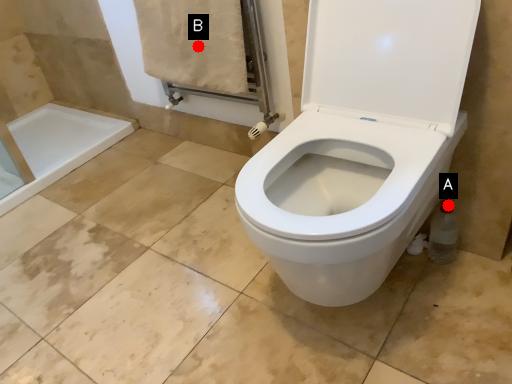
Question: Two points are circled on the image, labeled by A and B beside each circle. Which point appears farthest from the camera in this image?

Choices:
 (A) A is further
 (B) B is further

Answer: (B)